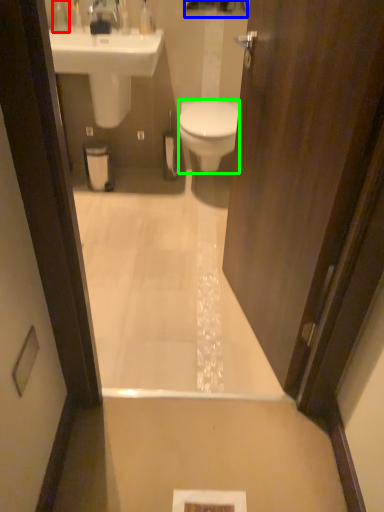
Question: Which object is the closest to the toiletry (highlighted by a red box)? Choose among these: mirror (highlighted by a blue box) or bidet (highlighted by a green box).

Choices:
 (A) mirror
 (B) bidet

Answer: (A)